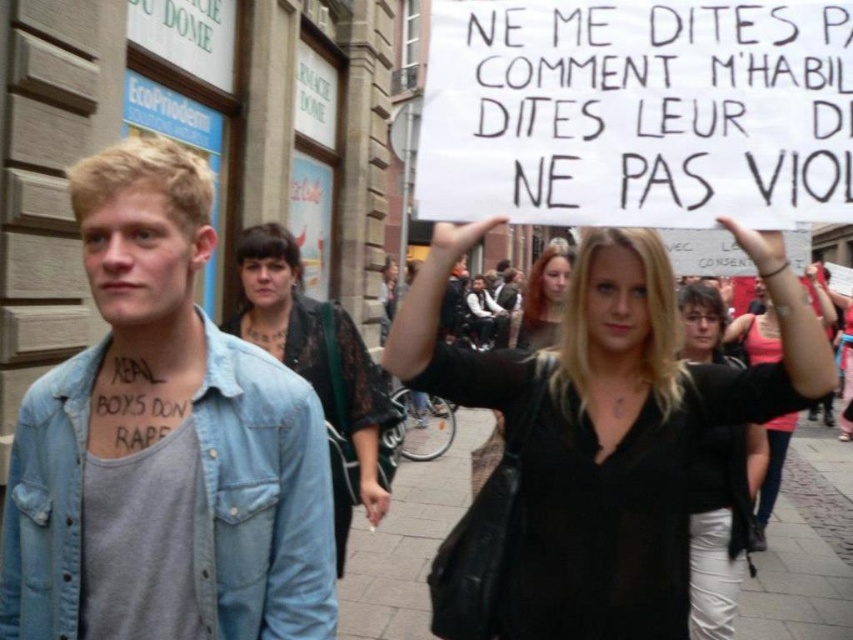
Is point (294, 604) closer to camera compared to point (746, 550)?

Yes, point (294, 604) is in front of point (746, 550).

Who is more distant from viewer, (x=99, y=241) or (x=706, y=568)?

Positioned behind is point (x=706, y=568).

This screenshot has width=853, height=640. Find the location of `denim jacket at left`. denim jacket at left is located at coordinates (163, 444).

Can you confirm if denim jacket at left is thinner than blonde hair at center?

Yes, denim jacket at left is thinner than blonde hair at center.

Does point (112, 259) come farther from viewer compared to point (561, 305)?

No, (112, 259) is in front of (561, 305).

Does point (55, 554) come in front of point (525, 348)?

Yes, it is.

The image size is (853, 640). Find the location of `denim jacket at left`. denim jacket at left is located at coordinates (163, 444).

Between denim jacket at left and black leather jacket at center, which one has more height?

denim jacket at left is taller.

Is denim jacket at left smaller than black leather jacket at center?

Yes.

Between point (157, 289) and point (444, 356), which one is positioned behind?

Positioned behind is point (444, 356).

Identify the location of denim jacket at left. The image size is (853, 640). (163, 444).